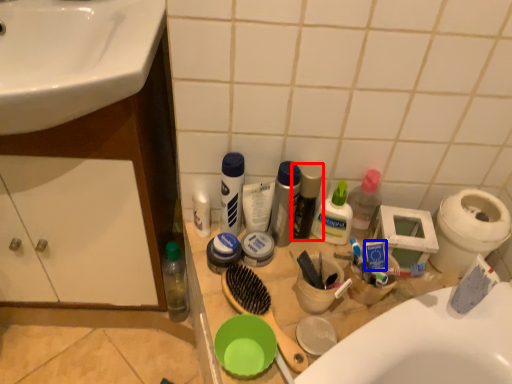
Question: Which point is further to the camera, toiletry (highlighted by a red box) or toothpaste (highlighted by a blue box)?

Choices:
 (A) toiletry
 (B) toothpaste

Answer: (A)